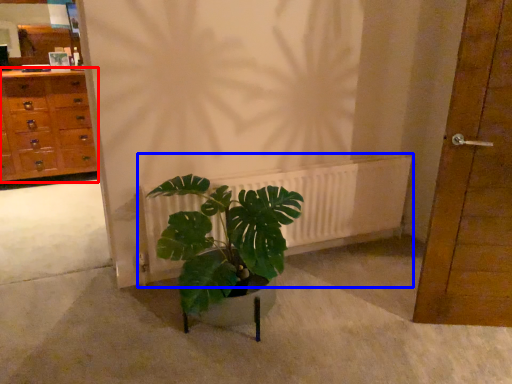
Question: Which object is closer to the camera taking this photo, chest of drawers (highlighted by a red box) or radiator (highlighted by a blue box)?

Choices:
 (A) chest of drawers
 (B) radiator

Answer: (B)